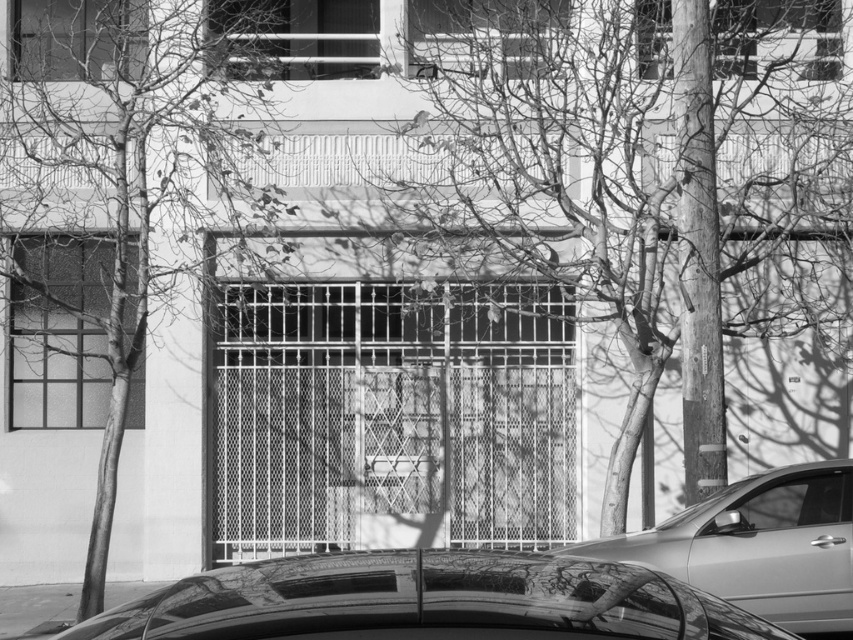
You are standing in front of the building facade. Where is the metallic silver car at lower right located in the image?

The metallic silver car at lower right is located at point coordinates of (759, 545).